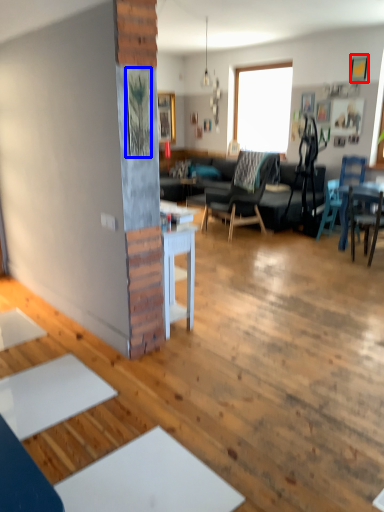
Question: Which object is further to the camera taking this photo, picture frame (highlighted by a red box) or picture frame (highlighted by a blue box)?

Choices:
 (A) picture frame
 (B) picture frame

Answer: (A)